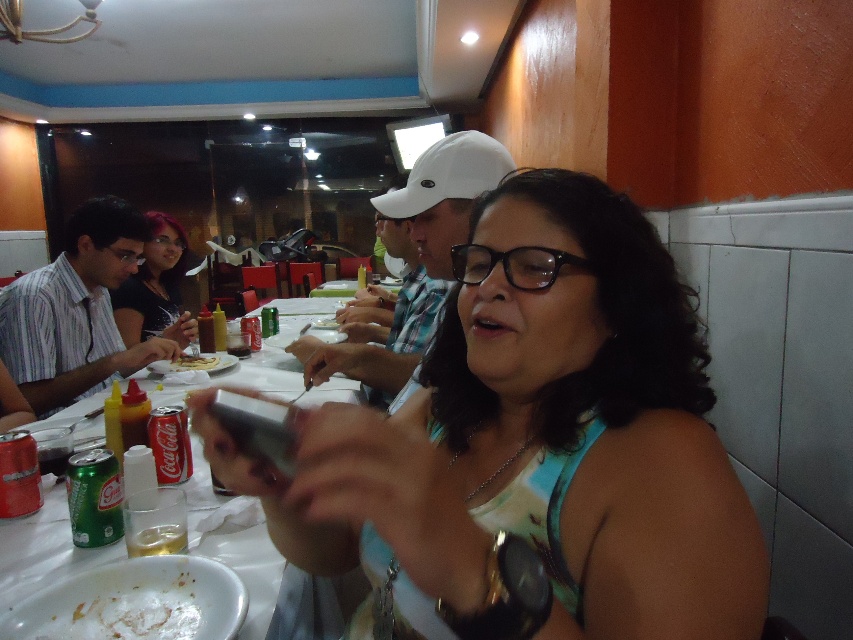
Question: Which of the following is the farthest from the observer?

Choices:
 (A) striped fabric shirt at left
 (B) white glossy plate at lower left
 (C) yellowish matte bread at center

Answer: (C)

Question: Is matte green tank top at center to the right of striped fabric shirt at left from the viewer's perspective?

Choices:
 (A) no
 (B) yes

Answer: (B)

Question: Which object appears closest to the camera in this image?

Choices:
 (A) striped fabric shirt at left
 (B) white glossy plate at lower left

Answer: (B)

Question: Is yellowish matte bread at center below white paper plate at center?

Choices:
 (A) no
 (B) yes

Answer: (B)

Question: Can you confirm if white glossy plate at lower left is positioned above yellowish matte bread at center?

Choices:
 (A) yes
 (B) no

Answer: (B)

Question: Which of the following is the closest to the observer?

Choices:
 (A) (193, 364)
 (B) (136, 252)

Answer: (A)